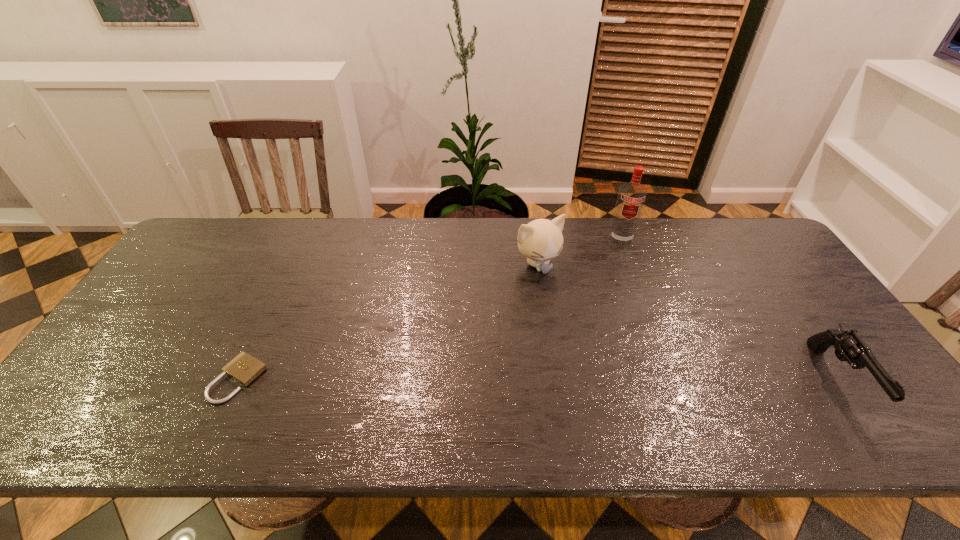
Where is `the shortest object`? the shortest object is located at coordinates (244, 368).

This screenshot has width=960, height=540. I want to click on the leftmost object, so click(x=244, y=368).

Locate an element on the screen. the second shortest object is located at coordinates (849, 346).

You are a GUI agent. You are given a task and a screenshot of the screen. Output one action in this format:
    pyautogui.click(x=<x>, y=<y>)
    Task: Click on the rightmost object
    
    Given the screenshot: What is the action you would take?
    pyautogui.click(x=849, y=346)

At what (x,y) coordinates should I click in order to perform the action: click on the third object from right to left. Please return your answer as a coordinate pair (x, y). Looking at the image, I should click on (541, 240).

Identify the location of kitten. The width and height of the screenshot is (960, 540). tap(541, 240).

Identify the location of the second object from right to left. (631, 197).

Locate an element on the screen. The width and height of the screenshot is (960, 540). the tallest object is located at coordinates (631, 197).

Locate an element on the screen. This screenshot has width=960, height=540. blank space located 0.220m on the left of the padlock is located at coordinates (122, 379).

I want to click on free space located 0.160m on the face of the third object from right to left, so click(x=577, y=315).